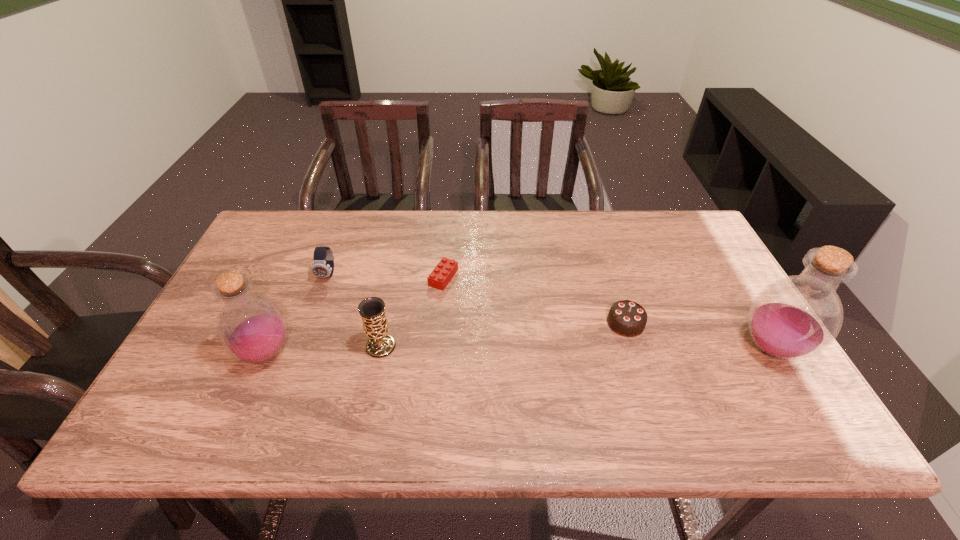
To make them evenly spaced by inserting another bottle among them, please locate a free space for this new bottle. Please provide its 2D coordinates. Your answer should be formatted as a tuple, i.e. [(x, y)], where the tuple contains the x and y coordinates of a point satisfying the conditions above.

[(521, 351)]